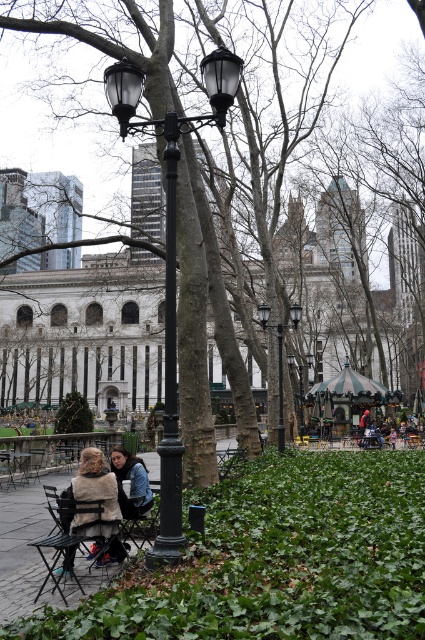
You are planning to place a small garden statue that is 1 meter tall in the park. The statue must be placed near the brown textured tree at center and the black metal chair at lower left. Considering their sizes, which object should the statue be placed closer to?

The brown textured tree at center is larger in size than the black metal chair at lower left. Therefore, the statue should be placed closer to the black metal chair at lower left to maintain visual balance.

You are a park visitor who wants to take a photo of the brown textured tree at center and the black metal chair at lower left. Which object should you focus on first to ensure it appears sharp in your photo?

You should focus on the brown textured tree at center first because it is closer to you than the black metal chair at lower left, so it requires a different focal plane.

You are standing at the entrance of the park and see the black metal chair at lower left. If you walk straight towards the center of the image, will you pass by the chair on your left or right side?

The black metal chair at lower left is located at point (65,538). Since you are walking straight towards the center from the entrance, the chair will be on your left side.